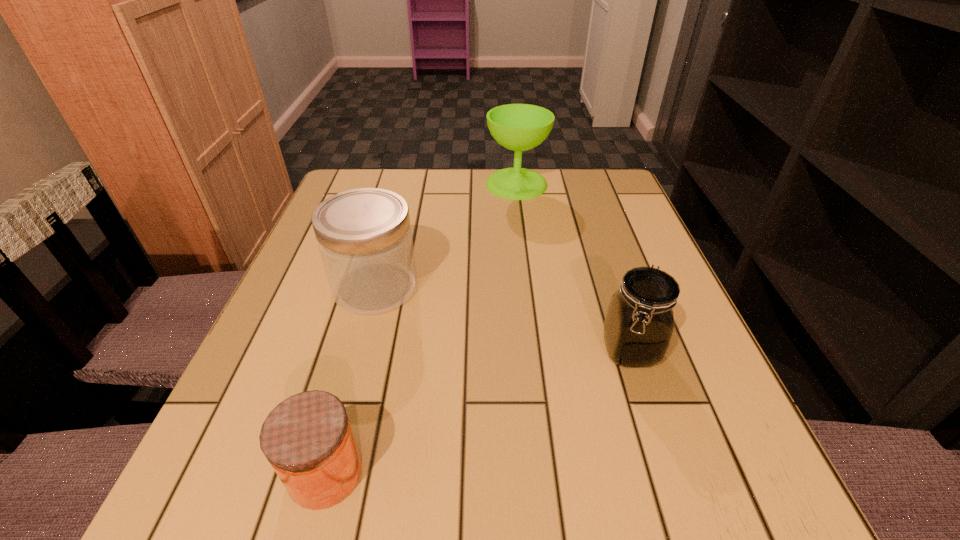
At what (x,y) coordinates should I click in order to perform the action: click on vacant region located 0.170m on the right of the shortest jar. Please return your answer as a coordinate pair (x, y). Image resolution: width=960 pixels, height=540 pixels. Looking at the image, I should click on (487, 472).

Identify the location of object situated at the far edge. The width and height of the screenshot is (960, 540). (519, 127).

This screenshot has height=540, width=960. Find the location of `object situated at the near edge`. object situated at the near edge is located at coordinates (307, 438).

I want to click on object that is positioned at the right edge, so click(x=639, y=324).

This screenshot has height=540, width=960. I want to click on object that is at the near left corner, so click(x=307, y=438).

Where is `free space at the far edge of the desktop`? free space at the far edge of the desktop is located at coordinates (495, 208).

In the image, there is a desktop. Where is `vacant area at the near edge`? vacant area at the near edge is located at coordinates point(478,487).

This screenshot has width=960, height=540. In the image, there is a desktop. What are the coordinates of `vacant space at the right edge` in the screenshot? It's located at (588, 241).

Where is `vacant region at the near left corner of the desktop`? The height and width of the screenshot is (540, 960). vacant region at the near left corner of the desktop is located at coordinates (251, 488).

This screenshot has width=960, height=540. I want to click on free space at the far right corner of the desktop, so click(573, 210).